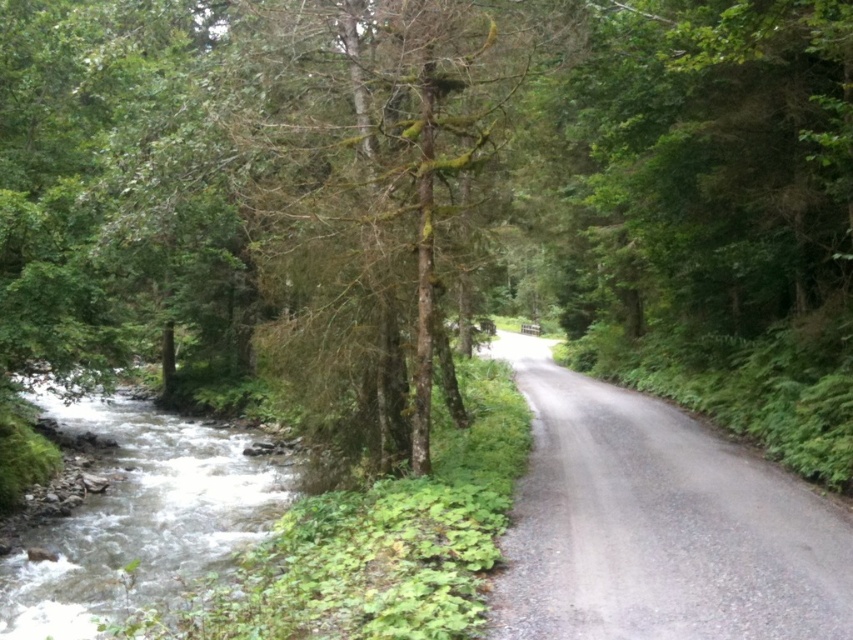
You are standing at the point labeled as point (363, 198) in the image. What is the immediate surface you are standing on?

The point (363, 198) is on green mossy tree at center, so you are standing on a green mossy tree at center.

You are a hiker standing on the gray gravel road at center. You want to take a photo of the green mossy tree at center. Which direction should you face to capture it in your camera?

The green mossy tree at center is to the left of the gray gravel road at center, so you should face left to capture it in your camera.